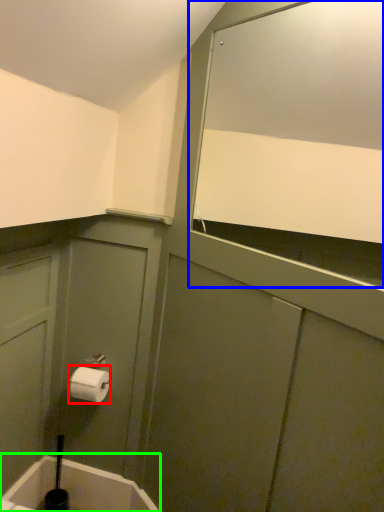
Question: Which object is the closest to the toilet paper (highlighted by a red box)? Choose among these: mirror (highlighted by a blue box) or bath (highlighted by a green box).

Choices:
 (A) mirror
 (B) bath

Answer: (B)